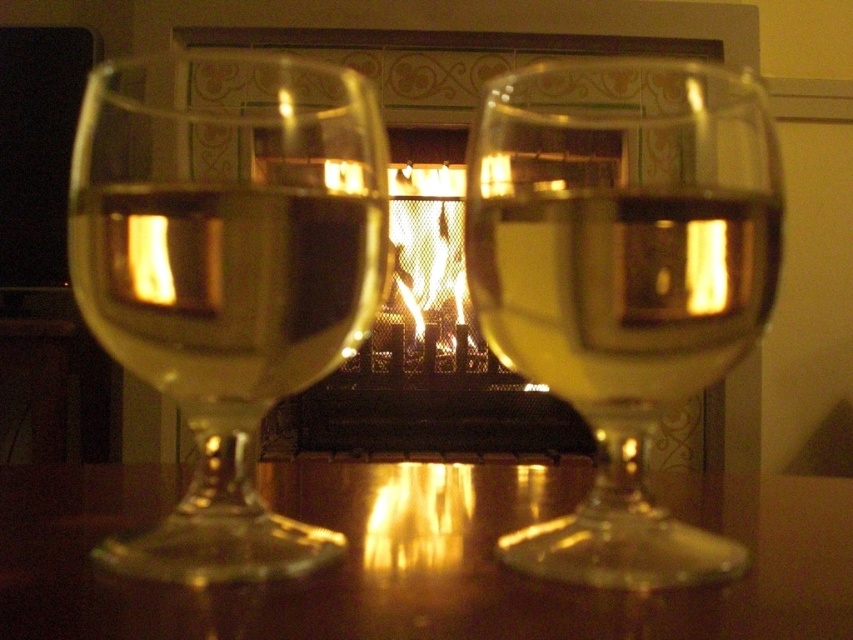
Question: Estimate the real-world distances between objects in this image. Which object is closer to the translucent glass at center?

Choices:
 (A) metallic mesh fireplace at center
 (B) transparent glass at left
 (C) transparent glass at right

Answer: (C)

Question: Which of the following is the farthest from the observer?

Choices:
 (A) translucent glass at left
 (B) transparent glass at left

Answer: (B)

Question: Does transparent glass at right have a larger size compared to metallic mesh fireplace at center?

Choices:
 (A) no
 (B) yes

Answer: (A)

Question: Which object is positioned closest to the glossy wood table at center?

Choices:
 (A) matte glass fireplace at center
 (B) translucent glass at center
 (C) transparent glass at left

Answer: (C)

Question: Is matte glass fireplace at center bigger than translucent glass at left?

Choices:
 (A) no
 (B) yes

Answer: (B)

Question: Does glossy wood table at center come behind matte glass fireplace at center?

Choices:
 (A) no
 (B) yes

Answer: (A)